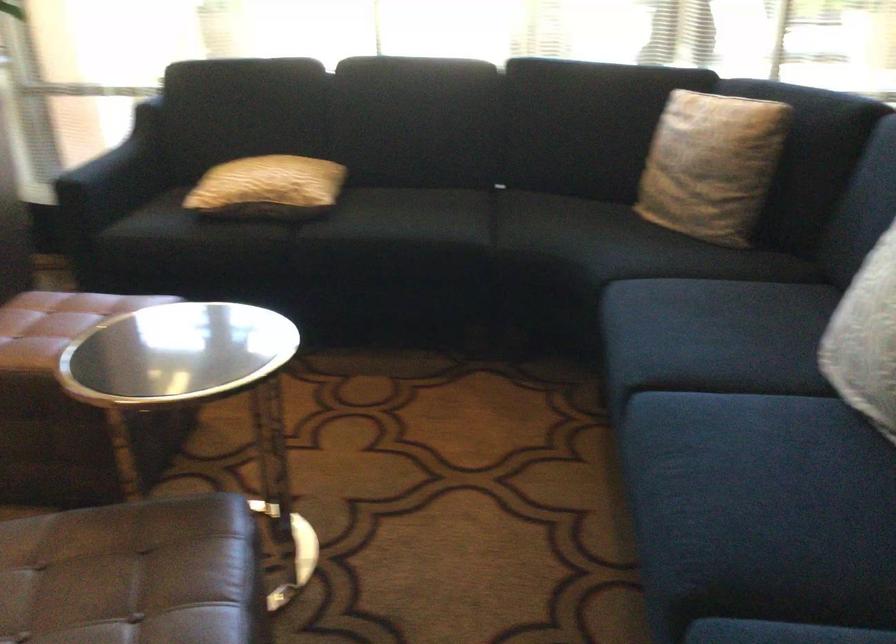
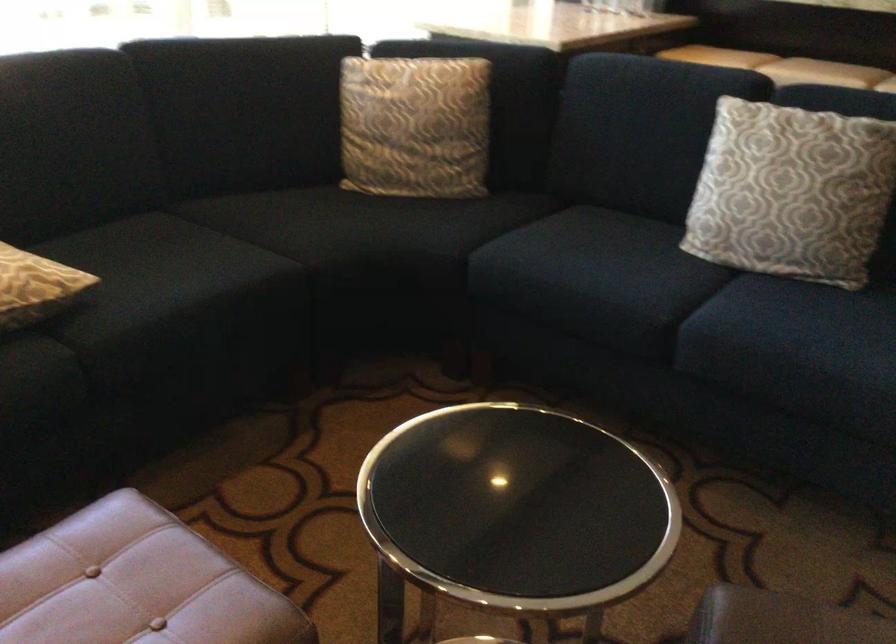
Locate, in the second image, the point that corresponds to [291,193] in the first image.

(35, 287)